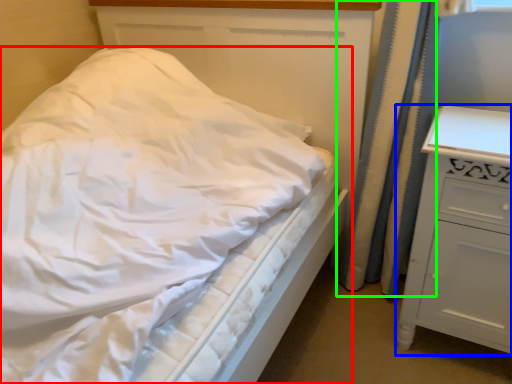
Question: Considering the real-world distances, which object is closest to bed (highlighted by a red box)? chest of drawers (highlighted by a blue box) or curtain (highlighted by a green box).

Choices:
 (A) chest of drawers
 (B) curtain

Answer: (A)